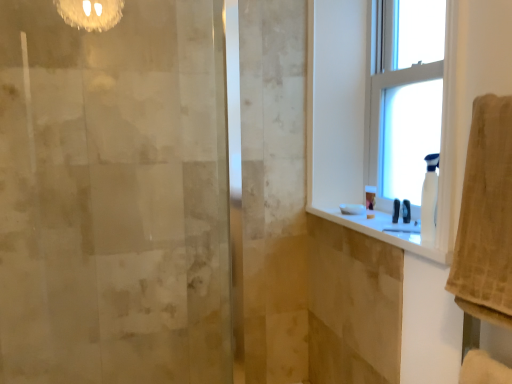
Question: In terms of height, does white plastic window at upper right, the second window in the right-to-left sequence, look taller or shorter compared to white glossy counter top at upper right?

Choices:
 (A) short
 (B) tall

Answer: (B)

Question: From the image's perspective, is white plastic window at upper right, the second window in the right-to-left sequence, above or below white glossy counter top at upper right?

Choices:
 (A) below
 (B) above

Answer: (B)

Question: Estimate the real-world distances between objects in this image. Which object is farther from the beige textured towel at right?

Choices:
 (A) white glossy counter top at upper right
 (B) white plastic spray bottle at right
 (C) white plastic window at upper right, which is the first window in left-to-right order
 (D) clear glass window at upper right, the first window from the right

Answer: (D)

Question: Which of these objects is positioned closest to the white plastic window at upper right, which is the first window in left-to-right order?

Choices:
 (A) clear glass window at upper right, the 2th window when ordered from left to right
 (B) beige textured towel at right
 (C) white glossy counter top at upper right
 (D) white plastic spray bottle at right

Answer: (A)